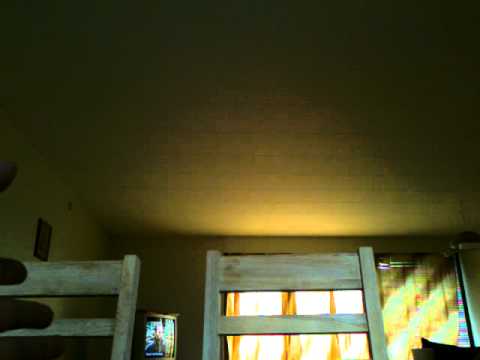
The width and height of the screenshot is (480, 360). What are the coordinates of `frame` in the screenshot? It's located at (45, 246).